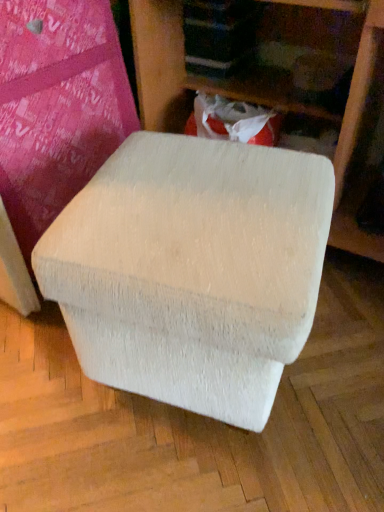
Locate an element on the screen. The height and width of the screenshot is (512, 384). vacant space in front of white textured bean bag at center is located at coordinates (190, 475).